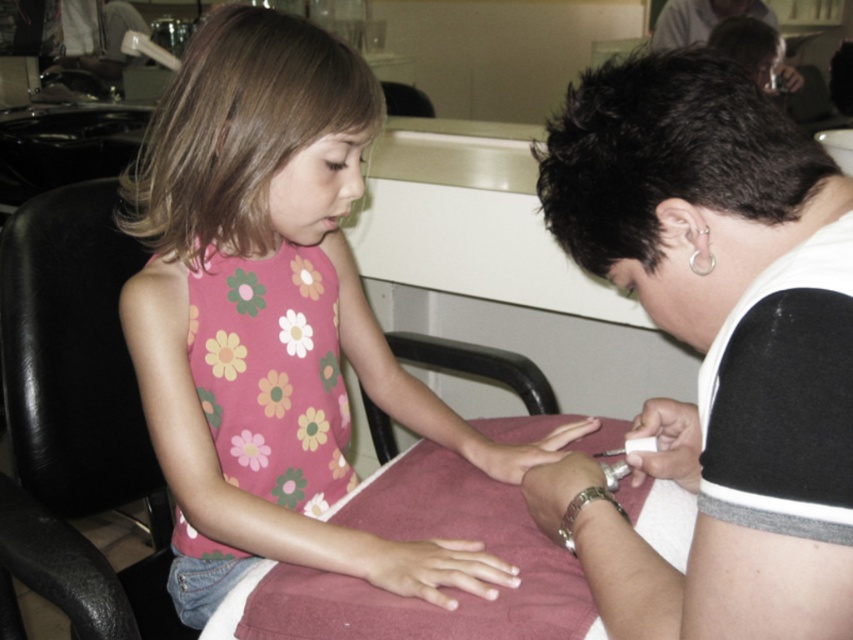
Question: Which of these objects is positioned closest to the pink floral tank top at center?

Choices:
 (A) white matte nails at center
 (B) white matte nail file at center
 (C) black leather chair at left

Answer: (C)

Question: Where is silver metallic bracelet at lower center located in relation to white matte nail file at center in the image?

Choices:
 (A) above
 (B) below

Answer: (B)

Question: Is black leather chair at left to the right of silver metallic bracelet at lower center from the viewer's perspective?

Choices:
 (A) no
 (B) yes

Answer: (A)

Question: Is white matte nails at center positioned at the back of white matte nail file at center?

Choices:
 (A) no
 (B) yes

Answer: (A)

Question: Which point is farther to the camera?

Choices:
 (A) (553, 433)
 (B) (277, 435)
 (C) (776, 193)
 (D) (695, 445)

Answer: (B)

Question: Which object appears farthest from the camera in this image?

Choices:
 (A) white matte nail file at center
 (B) white matte nails at center
 (C) matte white shirt at lower right
 (D) black leather chair at left

Answer: (A)